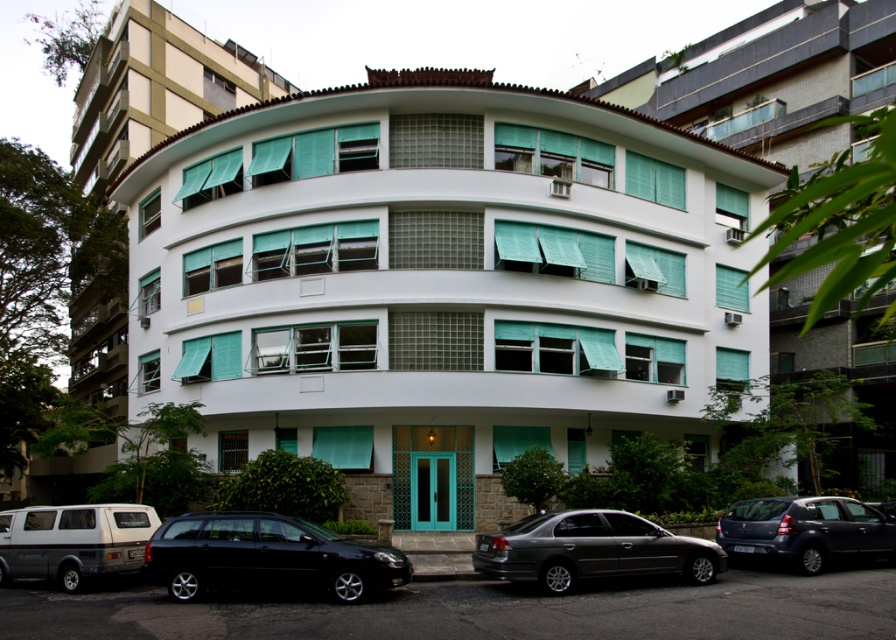
Which is more to the right, black matte station wagon at lower left or metallic gray sedan at center?

metallic gray sedan at center

Locate an element on the screen. black matte station wagon at lower left is located at coordinates (266, 556).

Measure the distance between point [306,545] and camera.

Point [306,545] and camera are 13.37 meters apart.

Find the location of `black matte station wagon at lower left`. black matte station wagon at lower left is located at coordinates (266, 556).

Does black matte station wagon at lower left appear on the right side of dark gray metallic car at lower right?

In fact, black matte station wagon at lower left is to the left of dark gray metallic car at lower right.

Is point (220, 572) closer to camera compared to point (849, 532)?

That is True.

In order to click on black matte station wagon at lower left in this screenshot , I will do `click(266, 556)`.

Is white matte van at lower left below dark gray metallic car at lower right?

Incorrect, white matte van at lower left is not positioned below dark gray metallic car at lower right.

Find the location of a particular element. white matte van at lower left is located at coordinates (73, 540).